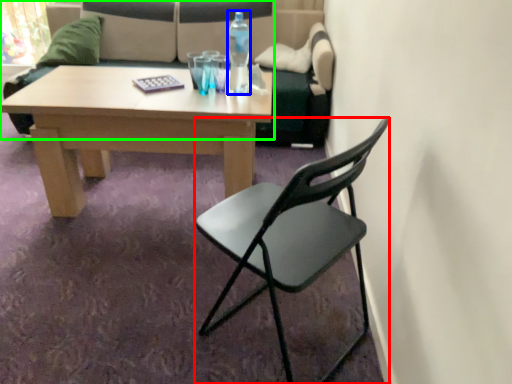
Question: Considering the real-world distances, which object is farthest from chair (highlighted by a red box)? bottle (highlighted by a blue box) or studio couch (highlighted by a green box)?

Choices:
 (A) bottle
 (B) studio couch

Answer: (B)